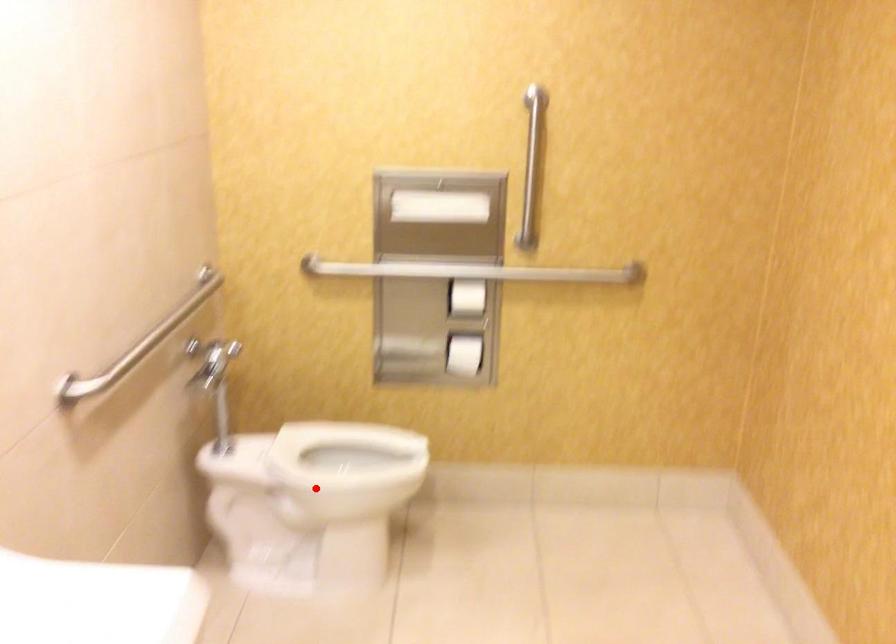
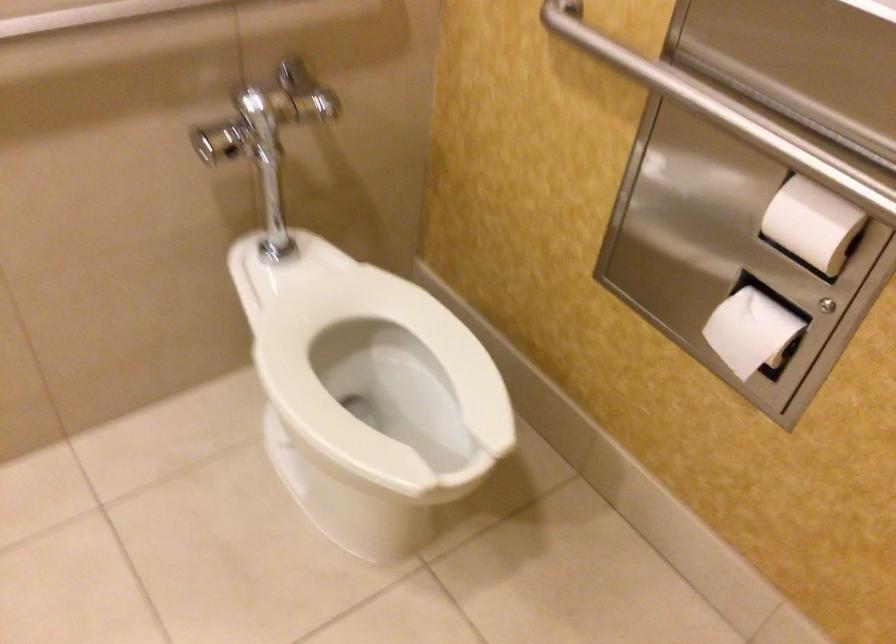
Where in the second image is the point corresponding to the highlighted location from the first image?

(380, 381)